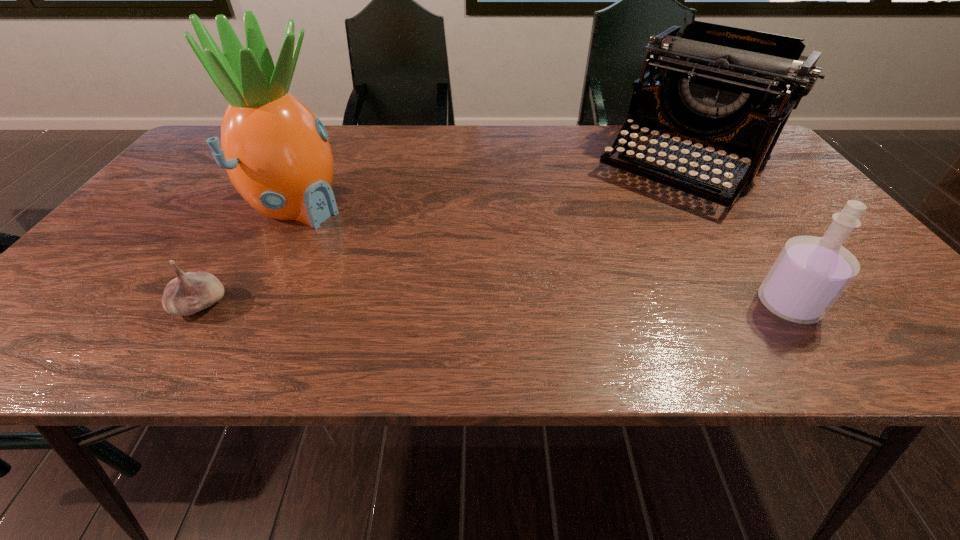
Identify the location of vacant space at the far right corner of the desktop. This screenshot has width=960, height=540. (741, 160).

Find the location of a particular element. This screenshot has height=540, width=960. free space between the tallest object and the typewriter is located at coordinates (491, 187).

At what (x,y) coordinates should I click in order to perform the action: click on vacant point located between the third tallest object and the third shortest object. Please return your answer as a coordinate pair (x, y). This screenshot has width=960, height=540. Looking at the image, I should click on (736, 236).

I want to click on free point between the third tallest object and the garlic, so click(494, 305).

At what (x,y) coordinates should I click in order to perform the action: click on free point between the third shortest object and the shortest object. Please return your answer as a coordinate pair (x, y). Looking at the image, I should click on (443, 237).

The height and width of the screenshot is (540, 960). I want to click on vacant area that lies between the pineapple and the shortest object, so click(x=249, y=256).

Where is `empty location between the pineapple and the garlic`? This screenshot has width=960, height=540. empty location between the pineapple and the garlic is located at coordinates (249, 256).

The image size is (960, 540). I want to click on vacant space in between the tallest object and the perfume, so click(x=542, y=256).

The image size is (960, 540). I want to click on free space that is in between the typewriter and the shortest object, so click(443, 237).

The height and width of the screenshot is (540, 960). Identify the location of empty space that is in between the perfume and the tallest object. (542, 256).